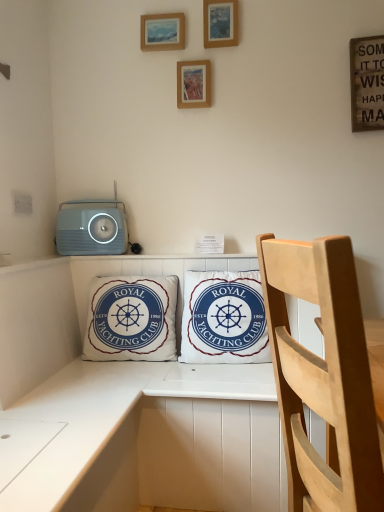
Question: Should I look upward or downward to see matte gray stereo at upper left?

Choices:
 (A) down
 (B) up

Answer: (B)

Question: From a real-world perspective, is white cotton pillow at center, the 1th pillow from the right, over wooden picture frame at upper center, which is the 1th picture frame in left-to-right order?

Choices:
 (A) yes
 (B) no

Answer: (B)

Question: Is white cotton pillow at center, acting as the 2th pillow starting from the left, bigger than wooden picture frame at upper center, which is the 1th picture frame in left-to-right order?

Choices:
 (A) yes
 (B) no

Answer: (A)

Question: Considering the relative sizes of white cotton pillow at center, the 1th pillow from the right, and wooden picture frame at upper center, which is the 1th picture frame in left-to-right order, in the image provided, is white cotton pillow at center, the 1th pillow from the right, shorter than wooden picture frame at upper center, which is the 1th picture frame in left-to-right order,?

Choices:
 (A) no
 (B) yes

Answer: (A)

Question: From a real-world perspective, is white cotton pillow at center, the 1th pillow from the right, under wooden picture frame at upper center, the third picture frame from the right?

Choices:
 (A) yes
 (B) no

Answer: (A)

Question: Is white cotton pillow at center, the 1th pillow from the right, thinner than wooden picture frame at upper center, positioned as the second picture frame in top-to-bottom order?

Choices:
 (A) yes
 (B) no

Answer: (B)

Question: Does white cotton pillow at center, the 1th pillow from the right, lie behind wooden picture frame at upper center, positioned as the 2th picture frame in bottom-to-top order?

Choices:
 (A) yes
 (B) no

Answer: (B)

Question: Can you confirm if light wood chair at right is wider than white cotton cushion at center, the 1th pillow in the left-to-right sequence?

Choices:
 (A) yes
 (B) no

Answer: (A)

Question: From the image's perspective, is light wood chair at right above white cotton cushion at center, the 1th pillow in the left-to-right sequence?

Choices:
 (A) no
 (B) yes

Answer: (A)

Question: Is light wood chair at right to the left of white cotton cushion at center, arranged as the 2th pillow when viewed from the right, from the viewer's perspective?

Choices:
 (A) no
 (B) yes

Answer: (A)

Question: Is light wood chair at right to the right of white cotton cushion at center, the 1th pillow in the left-to-right sequence, from the viewer's perspective?

Choices:
 (A) yes
 (B) no

Answer: (A)

Question: Does light wood chair at right lie behind white cotton cushion at center, the 1th pillow in the left-to-right sequence?

Choices:
 (A) yes
 (B) no

Answer: (B)

Question: From the image's perspective, would you say light wood chair at right is shown under white cotton cushion at center, the 1th pillow in the left-to-right sequence?

Choices:
 (A) no
 (B) yes

Answer: (B)

Question: Is the depth of white cotton pillow at center, acting as the 2th pillow starting from the left, greater than that of wooden picture frame at upper center, the 3th picture frame when ordered from bottom to top?

Choices:
 (A) yes
 (B) no

Answer: (B)